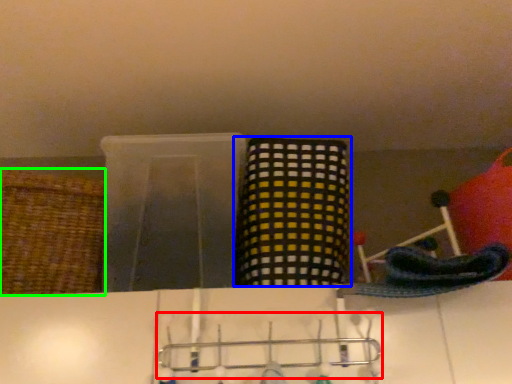
Question: Considering the real-world distances, which object is farthest from hanger (highlighted by a red box)? basket (highlighted by a blue box) or basket (highlighted by a green box)?

Choices:
 (A) basket
 (B) basket

Answer: (B)